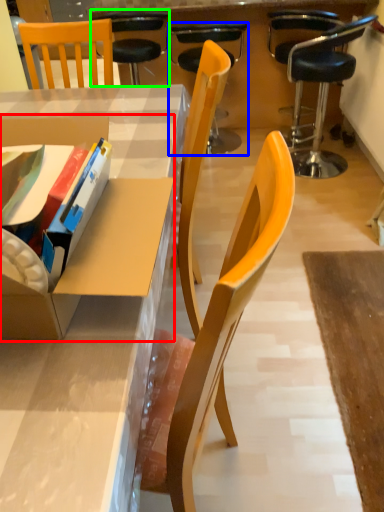
Question: Estimate the real-world distances between objects in this image. Which object is farther from cardboard box (highlighted by a red box), chair (highlighted by a blue box) or chair (highlighted by a green box)?

Choices:
 (A) chair
 (B) chair

Answer: (A)